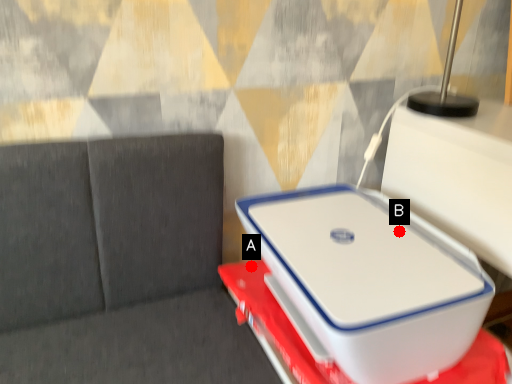
Question: Two points are circled on the image, labeled by A and B beside each circle. Which point is farther from the camera taking this photo?

Choices:
 (A) A is further
 (B) B is further

Answer: (A)